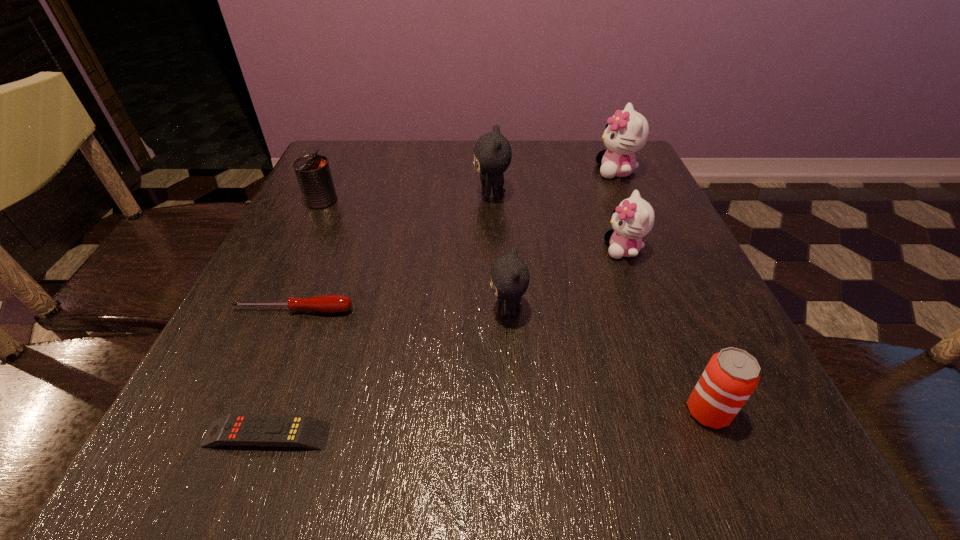
The image size is (960, 540). I want to click on free space located on the front-facing side of the third farthest kitten, so click(485, 249).

The width and height of the screenshot is (960, 540). I want to click on vacant space located on the front-facing side of the third farthest kitten, so click(x=444, y=249).

Where is `free point located on the front-facing side of the smaller gray kitten`? This screenshot has height=540, width=960. free point located on the front-facing side of the smaller gray kitten is located at coordinates (399, 310).

Identify the location of free spot located 0.280m on the front-facing side of the smaller gray kitten. (322, 310).

This screenshot has height=540, width=960. In order to click on vacant region located on the front-facing side of the smaller gray kitten in this screenshot , I will do `click(322, 310)`.

Where is `vacant area situated on the left of the beer can`? The image size is (960, 540). vacant area situated on the left of the beer can is located at coordinates (496, 411).

Locate an element on the screen. The image size is (960, 540). free region located on the front of the red screwdriver is located at coordinates (278, 346).

The image size is (960, 540). In order to click on vacant space located on the right of the shortest object in this screenshot , I will do `click(444, 435)`.

Where is `beer can that is at the near edge`? beer can that is at the near edge is located at coordinates (731, 376).

This screenshot has width=960, height=540. I want to click on remote control at the near edge, so click(x=302, y=431).